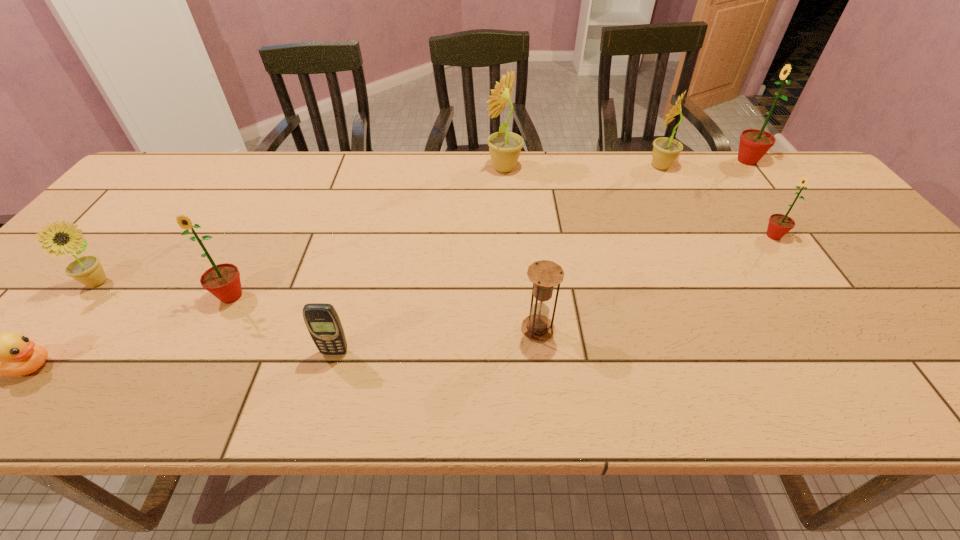
Point out which sunflower is positioned as the third nearest to the shortest object. Please provide its 2D coordinates. Your answer should be formatted as a tuple, i.e. [(x, y)], where the tuple contains the x and y coordinates of a point satisfying the conditions above.

[(505, 147)]

Where is `the sixth closest sunflower to the cellular telephone`? The height and width of the screenshot is (540, 960). the sixth closest sunflower to the cellular telephone is located at coordinates (754, 144).

Image resolution: width=960 pixels, height=540 pixels. Find the location of `yellow sunflower that is the third nearest to the second sunflower from right to left`. yellow sunflower that is the third nearest to the second sunflower from right to left is located at coordinates (87, 270).

Locate which yellow sunflower is the third closest to the duckling. Please provide its 2D coordinates. Your answer should be formatted as a tuple, i.e. [(x, y)], where the tuple contains the x and y coordinates of a point satisfying the conditions above.

[(666, 150)]

Point out which green sunflower is positioned as the third nearest to the fourth sunflower from left to right. Please provide its 2D coordinates. Your answer should be formatted as a tuple, i.e. [(x, y)], where the tuple contains the x and y coordinates of a point satisfying the conditions above.

[(223, 281)]

Locate which green sunflower ranks in proximity to the second smallest green sunflower. Please provide its 2D coordinates. Your answer should be formatted as a tuple, i.e. [(x, y)], where the tuple contains the x and y coordinates of a point satisfying the conditions above.

[(779, 225)]

The height and width of the screenshot is (540, 960). I want to click on vacant space that satisfies the following two spatial constraints: 1. on the face of the second green sunflower from left to right; 2. on the face of the second smallest green sunflower, so click(816, 296).

Find the location of a particular element. free location that satisfies the following two spatial constraints: 1. on the face of the second nearest green sunflower; 2. on the screen of the fourth object from left to right is located at coordinates (855, 352).

Locate an element on the screen. free spot that satisfies the following two spatial constraints: 1. on the face of the fourth sunflower from right to left; 2. on the face of the third object from left to right is located at coordinates (513, 296).

You are a GUI agent. You are given a task and a screenshot of the screen. Output one action in this format:
    pyautogui.click(x=<x>, y=<y>)
    Task: Click on the vacant point that satisfies the following two spatial constraints: 1. on the face of the brown hourglass; 2. on the right side of the second smallest green sunflower
    
    Given the screenshot: What is the action you would take?
    pyautogui.click(x=214, y=329)